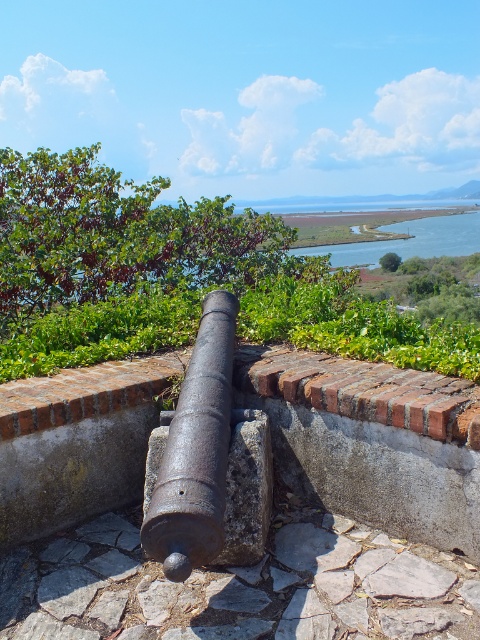
You are a tour guide describing this historical site to visitors. You mention the rusty metal cannon at center and the blue water at center. Which of these two is larger in size according to the scene?

The blue water at center is larger than the rusty metal cannon at center.

You are a tour guide explaining the historical site to visitors. You point to the rusty metal cannon at center and the blue water at center. Which object is located below the other?

The rusty metal cannon at center is positioned under the blue water at center, meaning the cannon is below the water.